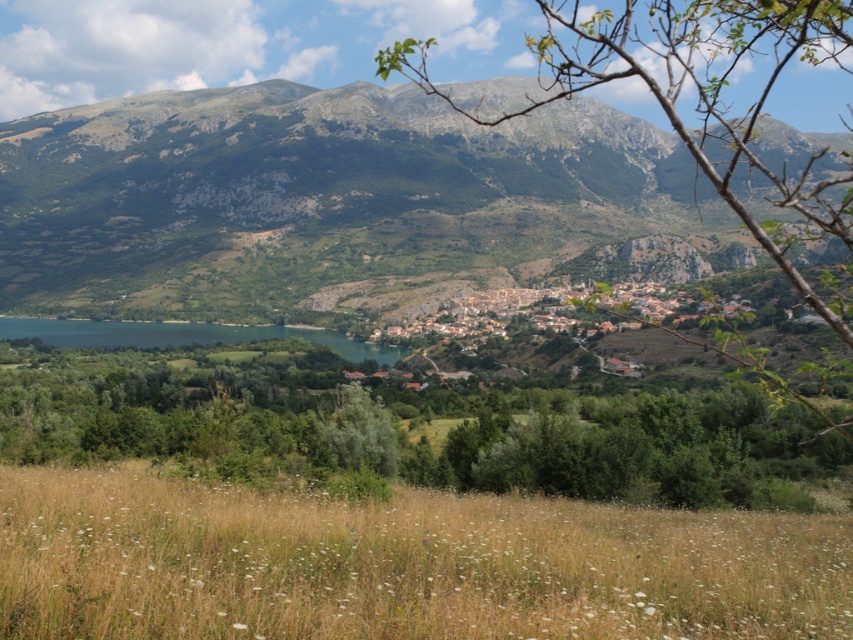
You are standing at the point labeled as point [317,196] in the image. What can you see directly in front of you?

At point [317,196], you are facing the green textured mountain at upper center directly in front of you.

You are standing at the edge of the dry grass at lower center and want to walk towards the brown stone village at center. Which direction should you head to reach the village?

To reach the brown stone village at center from the dry grass at lower center, you should head to the right since the dry grass is located to the left of the village.

You are standing at the center of the image and want to walk towards the dry grass at lower center. Which direction should you move in to reach it?

The dry grass at lower center is located at point 0.883 on the horizontal axis and 0.469 on the vertical axis. Since you are at the center, you should move towards the lower right direction to reach it.